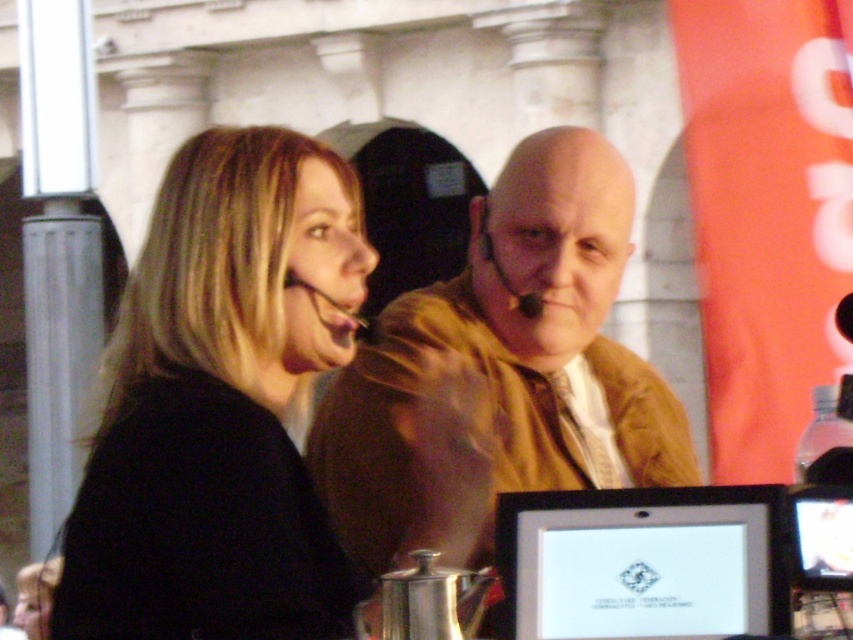
Who is shorter, black matte jacket at center or silver metallic laptop at center?

Standing shorter between the two is silver metallic laptop at center.

Is black matte jacket at center closer to camera compared to silver metallic laptop at center?

Yes, black matte jacket at center is in front of silver metallic laptop at center.

At what (x,y) coordinates should I click in order to perform the action: click on black matte jacket at center. Please return your answer as a coordinate pair (x, y). This screenshot has width=853, height=640. Looking at the image, I should click on (219, 404).

Does brown leather jacket at center have a lesser height compared to silver metallic laptop at center?

In fact, brown leather jacket at center may be taller than silver metallic laptop at center.

Is point (515, 356) in front of point (645, 632)?

No, it is behind (645, 632).

This screenshot has height=640, width=853. I want to click on brown leather jacket at center, so click(502, 371).

Can you confirm if black matte jacket at center is positioned to the left of brown leather jacket at center?

Correct, you'll find black matte jacket at center to the left of brown leather jacket at center.

Is black matte jacket at center shorter than brown leather jacket at center?

Yes.

The height and width of the screenshot is (640, 853). I want to click on black matte jacket at center, so click(x=219, y=404).

The width and height of the screenshot is (853, 640). What are the coordinates of `black matte jacket at center` in the screenshot? It's located at (219, 404).